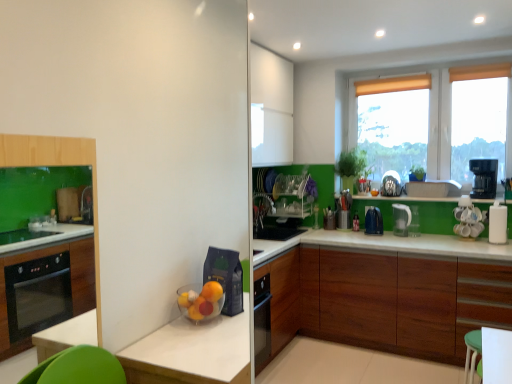
Where is `free space in front of white glossy coffee maker at right, the 3th appliance positioned from the left`? free space in front of white glossy coffee maker at right, the 3th appliance positioned from the left is located at coordinates (475, 246).